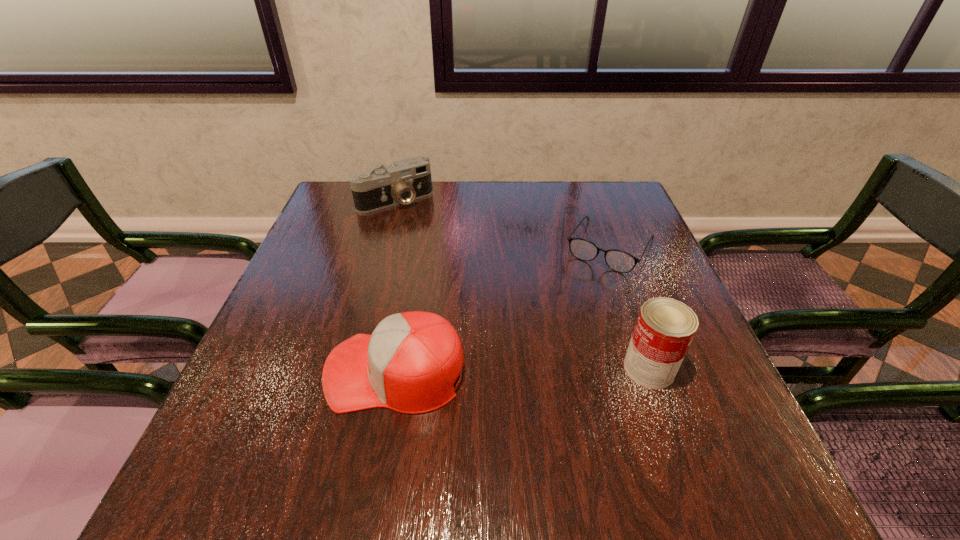
You are a GUI agent. You are given a task and a screenshot of the screen. Output one action in this format:
    pyautogui.click(x=<x>, y=<y>)
    Task: Click on the free space located 0.320m on the front-facing side of the spectacles
    The height and width of the screenshot is (540, 960).
    Given the screenshot: What is the action you would take?
    pyautogui.click(x=540, y=366)

Where is `free space located on the front-facing side of the spectacles`? This screenshot has height=540, width=960. free space located on the front-facing side of the spectacles is located at coordinates (586, 288).

Identify the location of vacant space situated on the lens of the farthest object. (466, 279).

In order to click on vacant space located on the lens of the farthest object in this screenshot , I will do `click(460, 272)`.

This screenshot has height=540, width=960. In order to click on vacant space located on the lens of the farthest object in this screenshot , I will do `click(424, 229)`.

Image resolution: width=960 pixels, height=540 pixels. I want to click on spectacles that is at the far edge, so click(x=620, y=261).

Where is `camera present at the far edge`? This screenshot has width=960, height=540. camera present at the far edge is located at coordinates (406, 180).

Locate an element on the screen. Image resolution: width=960 pixels, height=540 pixels. object that is at the near edge is located at coordinates (409, 364).

Identify the location of baseball cap located in the left edge section of the desktop. (409, 364).

This screenshot has width=960, height=540. I want to click on camera that is at the left edge, so click(x=406, y=180).